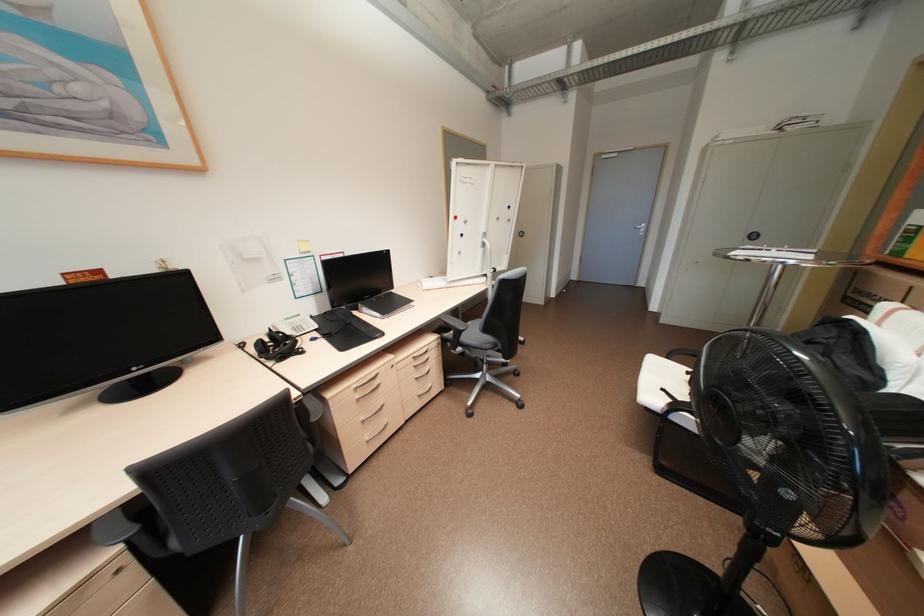
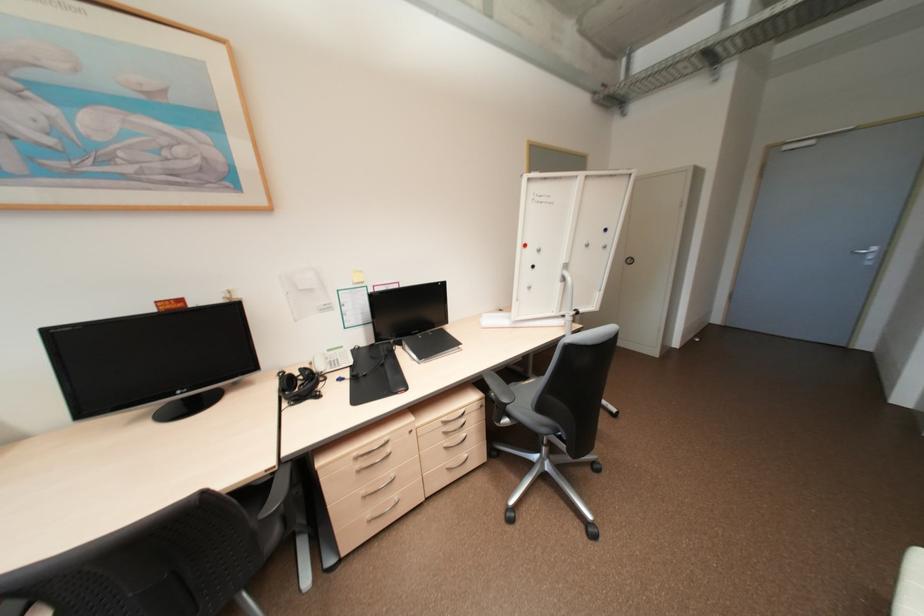
In a continuous first-person perspective shot, in which direction is the camera moving?

The cameraman moved toward right, forward.